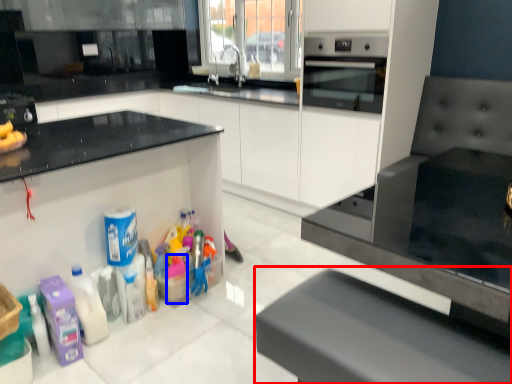
Question: Which of the following is the closest to the observer, furniture (highlighted by a red box) or cleaning product (highlighted by a blue box)?

Choices:
 (A) furniture
 (B) cleaning product

Answer: (A)